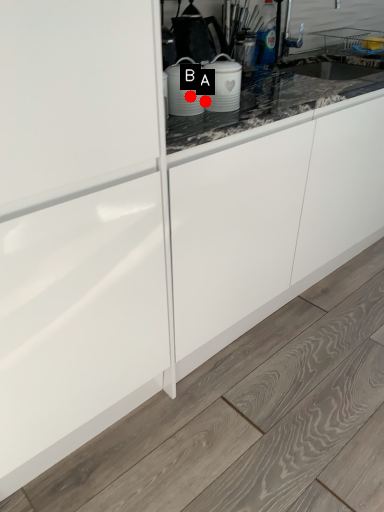
Question: Two points are circled on the image, labeled by A and B beside each circle. Which point is further to the camera?

Choices:
 (A) A is further
 (B) B is further

Answer: (A)